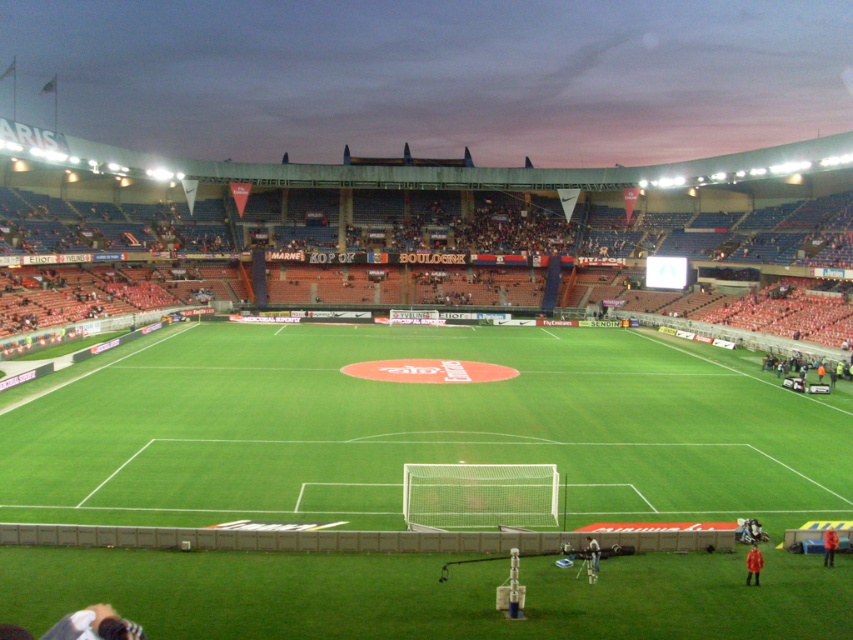
Question: Is red fabric jacket at lower right smaller than red fabric person at lower center?

Choices:
 (A) no
 (B) yes

Answer: (A)

Question: Is green grass football field at center smaller than red fabric person at lower center?

Choices:
 (A) yes
 (B) no

Answer: (B)

Question: Among these objects, which one is nearest to the camera?

Choices:
 (A) red fabric jacket at lower right
 (B) red jacket at center
 (C) red fabric person at lower center

Answer: (B)

Question: Is red fabric jacket at lower right closer to camera compared to red fabric person at lower center?

Choices:
 (A) yes
 (B) no

Answer: (B)

Question: Which object is farther from the camera taking this photo?

Choices:
 (A) red fabric jacket at lower right
 (B) green grass football field at center
 (C) red jacket at center

Answer: (B)

Question: Which of the following is the closest to the observer?

Choices:
 (A) (592, 568)
 (B) (489, 461)
 (C) (756, 576)

Answer: (C)